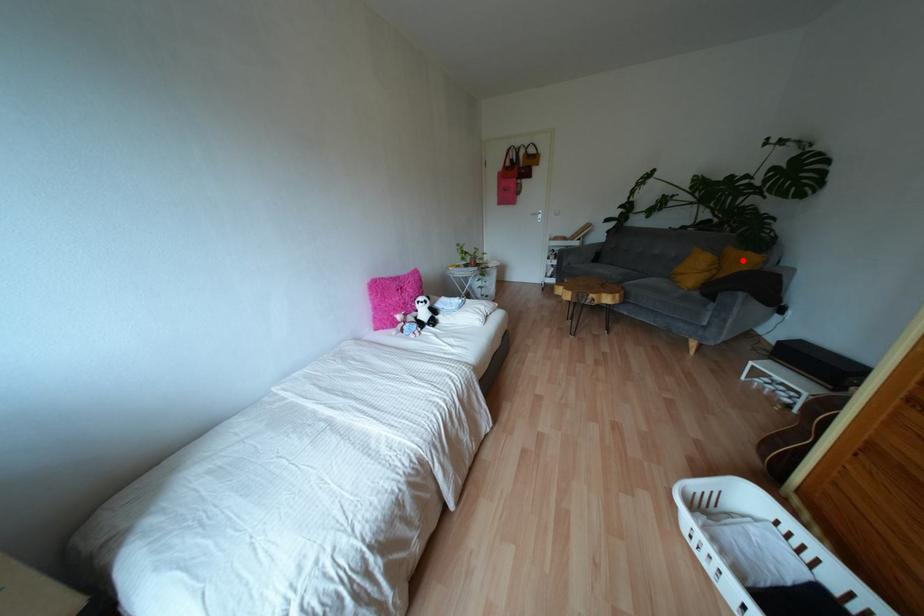
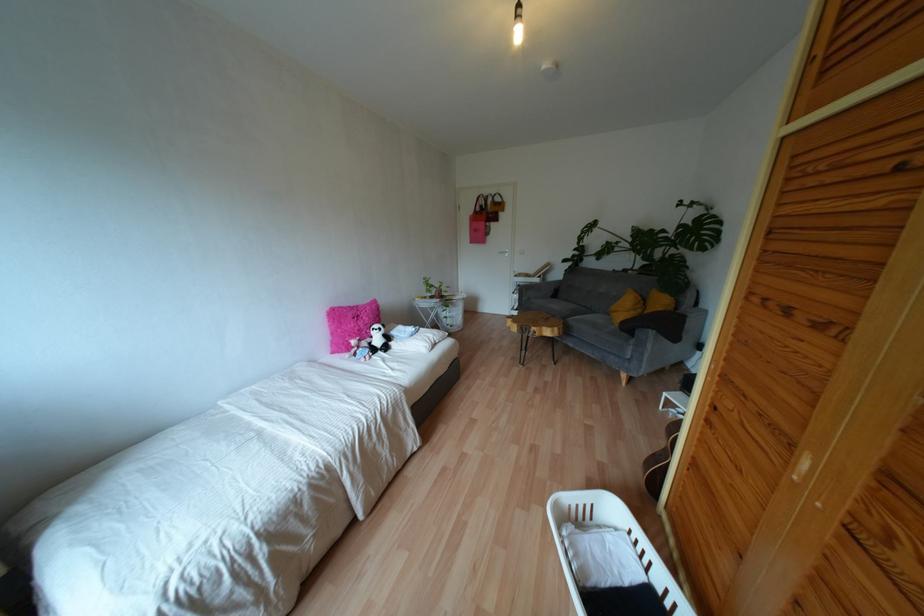
Question: I am providing you with two images of the same scene from different viewpoints. Given a red point in image1, look at the same physical point in image2. Is it:

Choices:
 (A) Closer to the viewpoint
 (B) Farther from the viewpoint

Answer: (A)